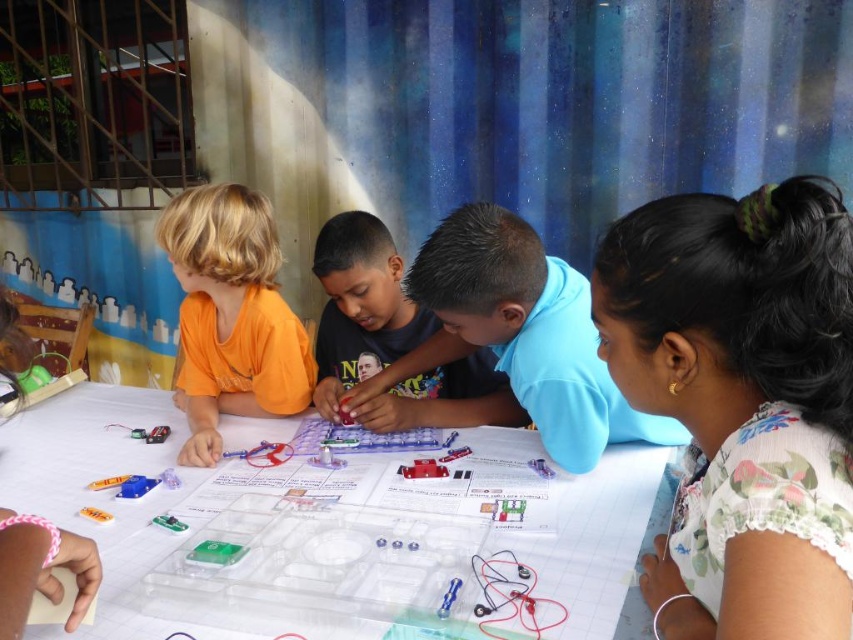
Does clear plastic table at center have a larger size compared to orange matte shirt at left?

Yes.

The width and height of the screenshot is (853, 640). Find the location of `clear plastic table at center`. clear plastic table at center is located at coordinates (103, 492).

Is the position of orange matte shirt at left more distant than that of blue matte shirt at center?

No, it is in front of blue matte shirt at center.

Who is positioned more to the right, orange matte shirt at left or blue matte shirt at center?

From the viewer's perspective, blue matte shirt at center appears more on the right side.

Identify the location of orange matte shirt at left. (230, 316).

I want to click on orange matte shirt at left, so click(x=230, y=316).

From the picture: Does clear plastic table at center have a larger size compared to blue matte shirt at center?

Yes, clear plastic table at center is bigger than blue matte shirt at center.

Can you confirm if clear plastic table at center is positioned above blue matte shirt at center?

Incorrect, clear plastic table at center is not positioned above blue matte shirt at center.

Is point (94, 476) positioned after point (378, 266)?

No, it is in front of (378, 266).

What are the coordinates of `clear plastic table at center` in the screenshot? It's located at (103, 492).